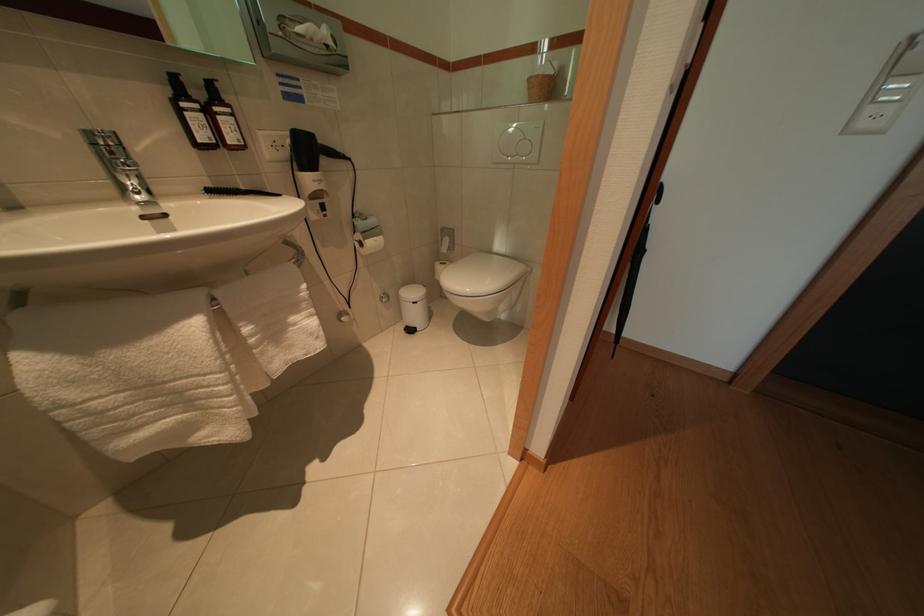
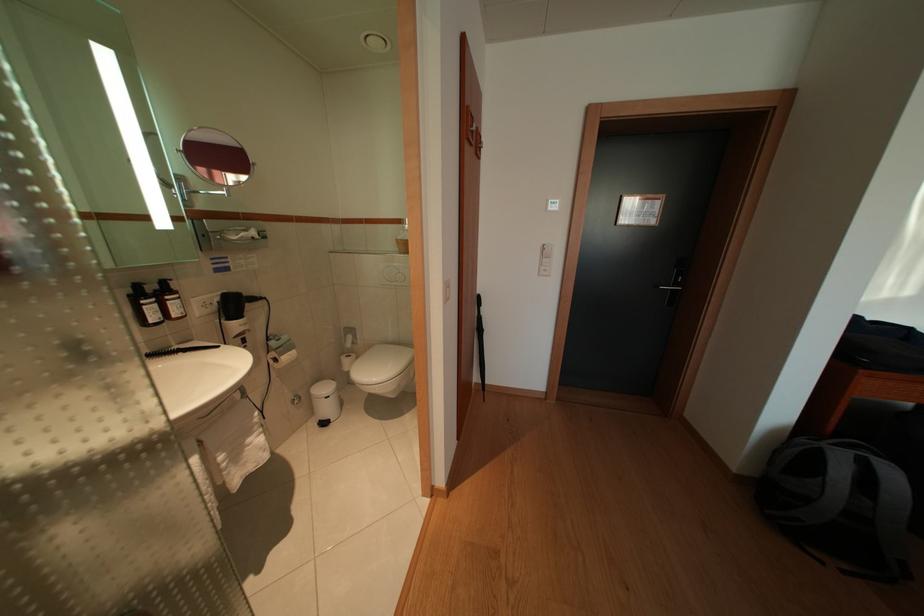
Locate, in the second image, the point that corresponds to [211,123] in the first image.

(164, 312)